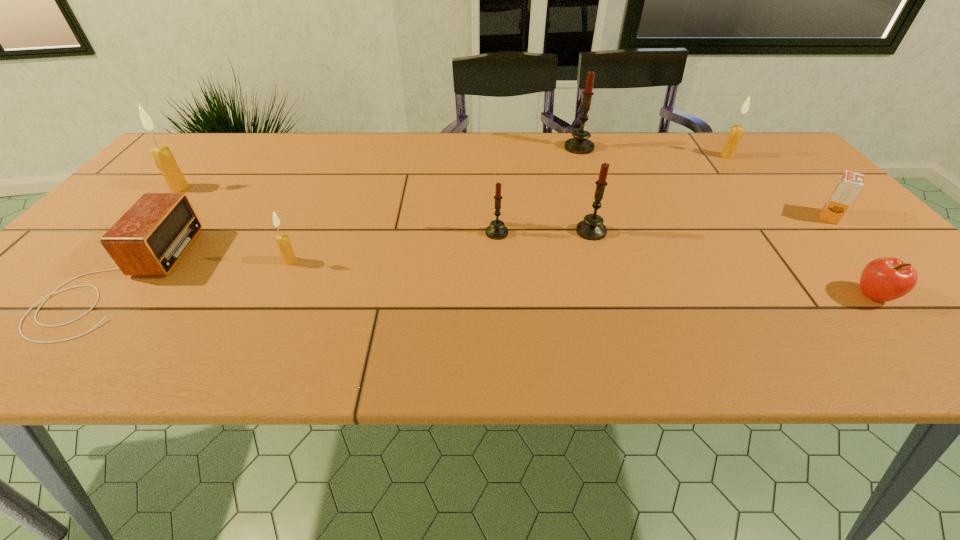
Locate an element on the screen. The height and width of the screenshot is (540, 960). vacant space at the far right corner is located at coordinates (767, 145).

Locate an element on the screen. This screenshot has width=960, height=540. free space between the nearest candle and the orange orange juice is located at coordinates pos(560,239).

Where is `free space between the farthest red candle and the third farthest object`? The height and width of the screenshot is (540, 960). free space between the farthest red candle and the third farthest object is located at coordinates (379, 167).

The width and height of the screenshot is (960, 540). Identify the location of vacant space that is in between the nearest cream candle and the fourth object from left to right. (394, 247).

Image resolution: width=960 pixels, height=540 pixels. Identify the location of empty location between the nearest candle and the second smallest red candle. (441, 246).

Locate an element on the screen. The height and width of the screenshot is (540, 960). free space that is in between the rightmost cream candle and the farthest red candle is located at coordinates (653, 152).

This screenshot has height=540, width=960. What are the coordinates of `free point between the third object from left to right and the orange orange juice` in the screenshot? It's located at (560, 239).

This screenshot has width=960, height=540. Find the location of `free space between the farthest red candle and the orange orange juice`. free space between the farthest red candle and the orange orange juice is located at coordinates (704, 182).

Where is `vacant region between the biggest cream candle and the second biggest red candle`? The width and height of the screenshot is (960, 540). vacant region between the biggest cream candle and the second biggest red candle is located at coordinates (386, 210).

Where is `free spot between the orange juice and the third object from right to left`? The image size is (960, 540). free spot between the orange juice and the third object from right to left is located at coordinates (778, 186).